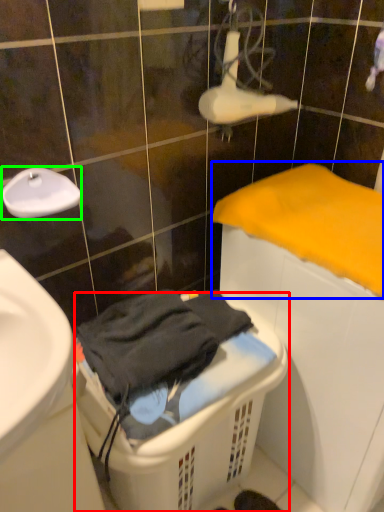
Question: Which object is positioned farthest from laundry basket (highlighted by a red box)? Select from bath towel (highlighted by a blue box) and faucet (highlighted by a green box).

Choices:
 (A) bath towel
 (B) faucet

Answer: (B)